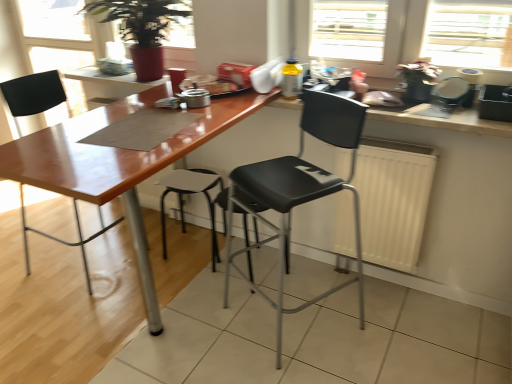
I want to click on spots to the right of matte black stool at center, so click(252, 264).